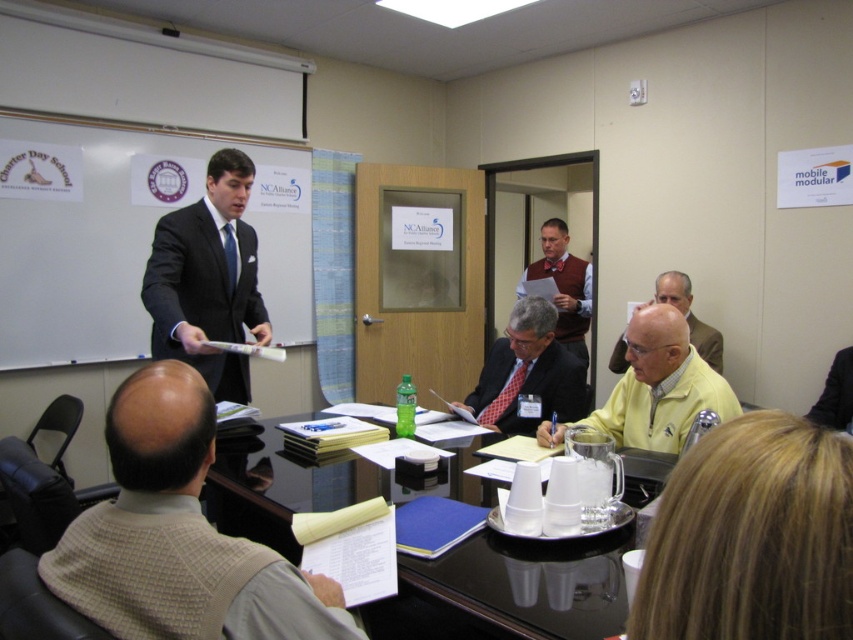
Based on the photo, you are organizing a small event and need to place a velvet bow tie at center on the black glossy table at center. Given that the table is larger, will there be enough space to place the bow tie without it falling off?

The black glossy table at center is larger in size than the velvet bow tie at center, so there will be sufficient space to place the bow tie without it falling off.

In the conference room scene, there is a black glossy table at center and a velvet bow tie at center. From the perspective of someone sitting at the table, which object is positioned to the left?

The black glossy table at center is to the left of the velvet bow tie at center, so from the perspective of someone sitting at the table, the black glossy table at center would be on the left side.

You are attending a meeting in the conference room and need to place a name tag on the table. However, you notice both the black glossy table at center and the velvet bow tie at center. Which object is closer to you if you are standing at the entrance of the room?

The black glossy table at center is located below the velvet bow tie at center, so if you are standing at the entrance, the velvet bow tie at center is closer to you since it is above the table.